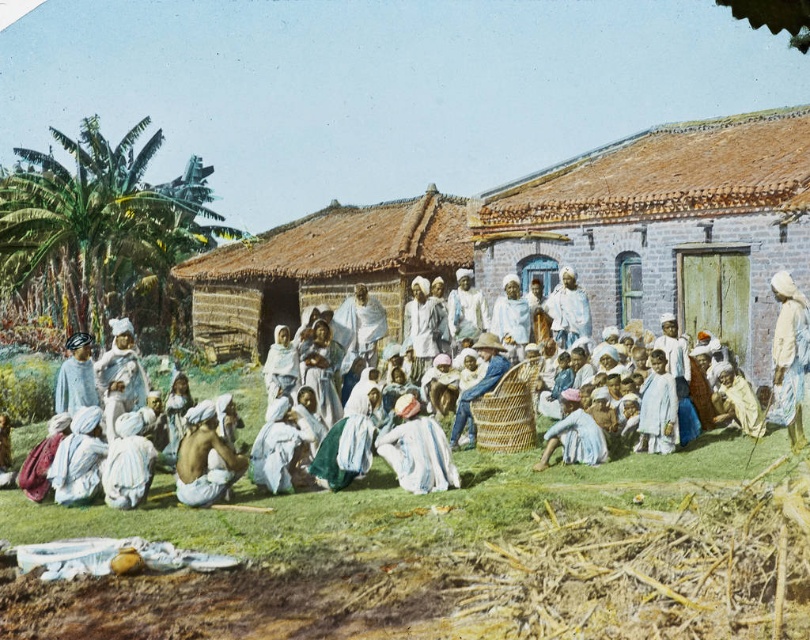
Question: Which of these objects is positioned closest to the light brown skin at center?

Choices:
 (A) light blue fabric at center
 (B) brown thatched hut at center
 (C) white cotton turban at center

Answer: (C)

Question: Does brick textured hut at center have a larger size compared to brown thatched hut at center?

Choices:
 (A) yes
 (B) no

Answer: (B)

Question: Which of the following is the farthest from the observer?

Choices:
 (A) (484, 266)
 (B) (637, 451)
 (C) (243, 468)
 (D) (779, 340)

Answer: (A)

Question: Is white cotton turban at center closer to camera compared to light brown skin at center?

Choices:
 (A) no
 (B) yes

Answer: (B)

Question: Is white cotton turban at center below light blue fabric at center?

Choices:
 (A) no
 (B) yes

Answer: (B)

Question: Based on their relative distances, which object is nearer to the light blue fabric at center?

Choices:
 (A) light brown skin at center
 (B) brown thatched hut at center
 (C) white cotton turban at center

Answer: (C)